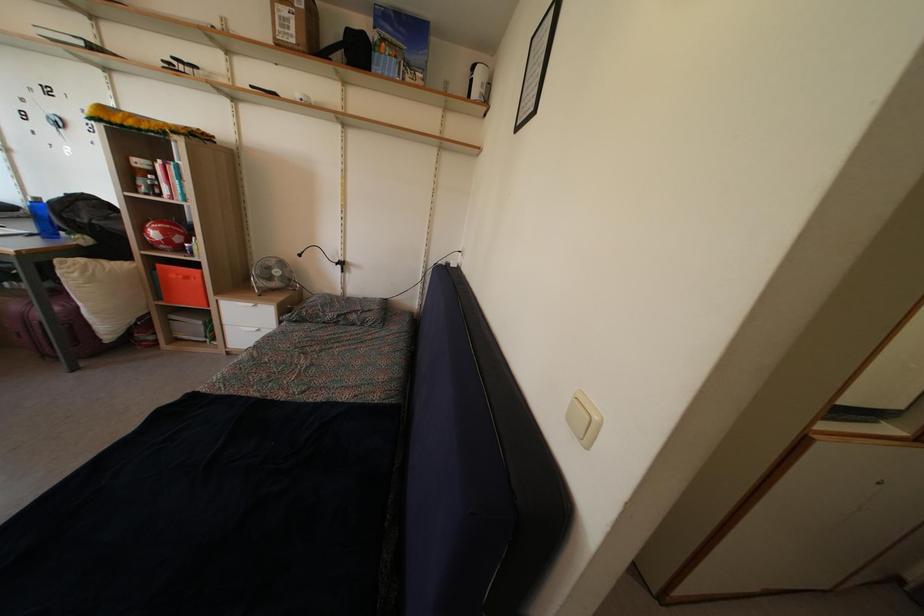
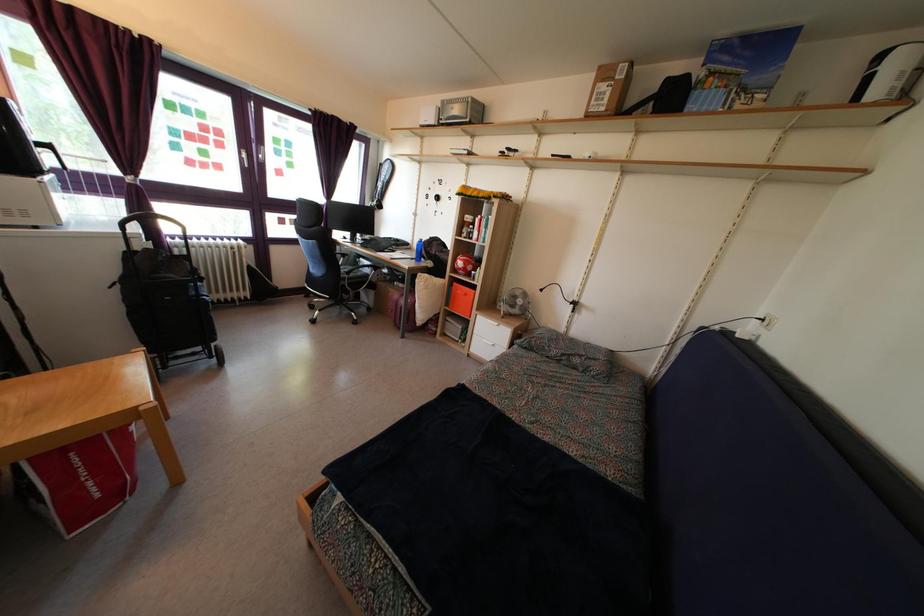
The point at (189, 286) is marked in the first image. Where is the corresponding point in the second image?

(468, 302)